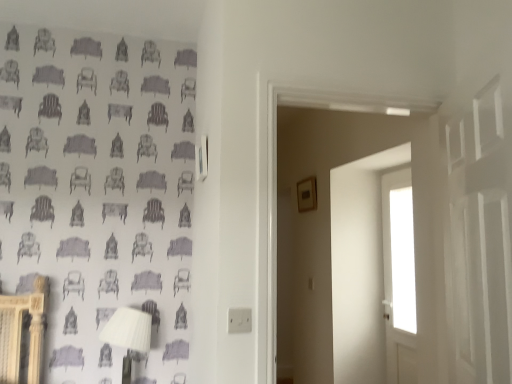
Question: Considering the positions of transparent glass window at upper right, which is counted as the first window, starting from the top, and white plastic table lamp at lower left in the image, is transparent glass window at upper right, which is counted as the first window, starting from the top, bigger or smaller than white plastic table lamp at lower left?

Choices:
 (A) big
 (B) small

Answer: (B)

Question: From the image's perspective, is transparent glass window at upper right, which is counted as the 2th window, starting from the bottom, positioned above or below white plastic table lamp at lower left?

Choices:
 (A) below
 (B) above

Answer: (B)

Question: Based on their relative distances, which object is nearer to the transparent glass window at upper right, which is counted as the first window, starting from the top?

Choices:
 (A) white plastic table lamp at lower left
 (B) transparent glass door at center, placed as the first window when sorted from bottom to top

Answer: (B)

Question: Which object is positioned closest to the white plastic table lamp at lower left?

Choices:
 (A) transparent glass door at center, the second window from the top
 (B) transparent glass window at upper right, which is counted as the first window, starting from the top

Answer: (B)